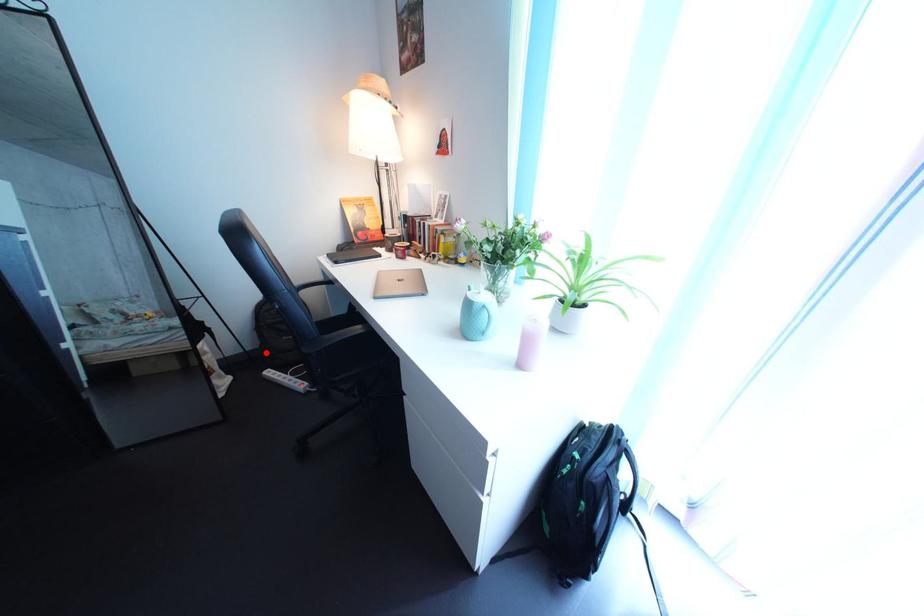
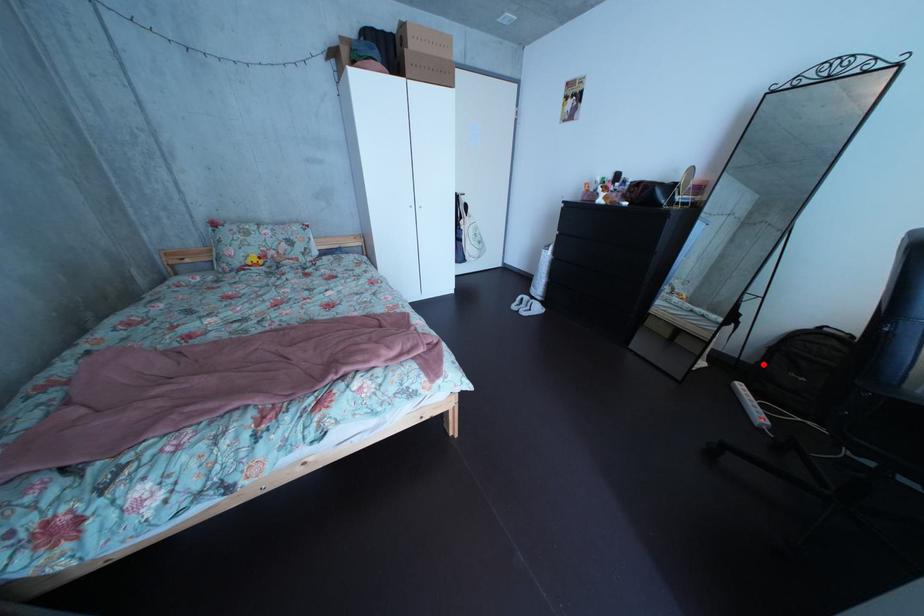
I am providing you with two images of the same scene from different viewpoints. A red point is marked on the first image and another point is marked on the second image. Do the highlighted points in image1 and image2 indicate the same real-world spot?

Yes